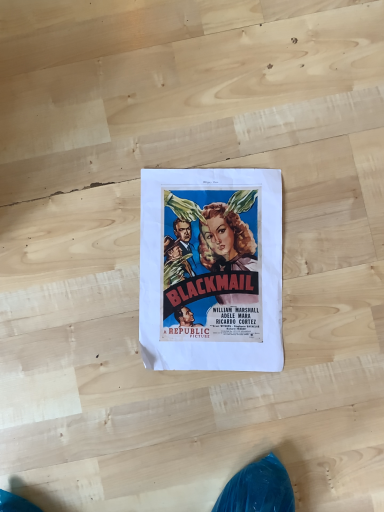
The width and height of the screenshot is (384, 512). Describe the element at coordinates (211, 269) in the screenshot. I see `vivid paper poster at center` at that location.

Locate an element on the screen. vivid paper poster at center is located at coordinates (211, 269).

This screenshot has height=512, width=384. What are the coordinates of `vivid paper poster at center` in the screenshot? It's located at (211, 269).